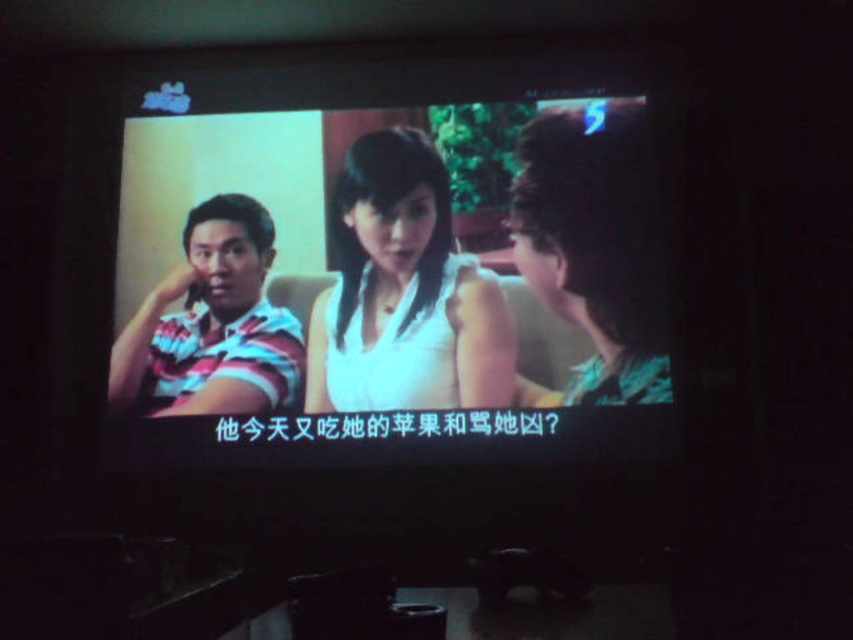
Consider the image. Is matte white shirt at center above white matte shirt at center?

Indeed, matte white shirt at center is positioned over white matte shirt at center.

Which of these two, matte white shirt at center or white matte shirt at center, stands taller?

matte white shirt at center

Measure the distance between point [432,192] and camera.

Point [432,192] and camera are 4.58 meters apart from each other.

Identify the location of matte white shirt at center. The height and width of the screenshot is (640, 853). (387, 278).

Who is lower down, matte white shirt at center or striped fabric shirt at left?

striped fabric shirt at left

Consider the image. Is the position of matte white shirt at center less distant than that of striped fabric shirt at left?

Yes, matte white shirt at center is in front of striped fabric shirt at left.

Measure the distance between point (608,248) and camera.

14.67 feet

Where is `matte white shirt at center`? Image resolution: width=853 pixels, height=640 pixels. matte white shirt at center is located at coordinates (387, 278).

Who is more forward, (410, 240) or (142, 380)?

Point (142, 380)

Who is lower down, white matte shirt at center or striped fabric shirt at left?

striped fabric shirt at left

What do you see at coordinates (404, 292) in the screenshot? This screenshot has width=853, height=640. I see `white matte shirt at center` at bounding box center [404, 292].

Where is `white matte shirt at center`? white matte shirt at center is located at coordinates (404, 292).